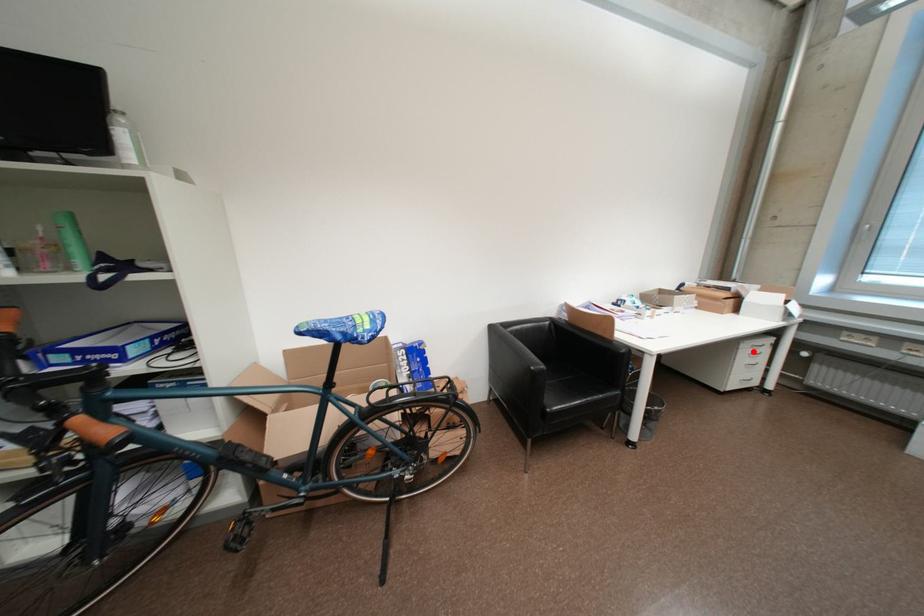
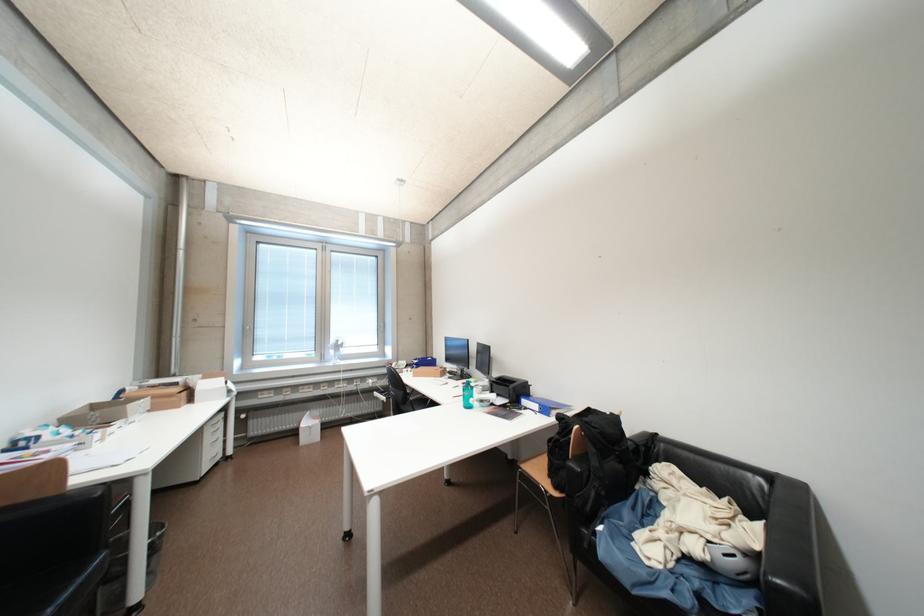
Question: I am providing you with two images of the same scene from different viewpoints. Image1 has a red point marked. In image2, the corresponding 3D location appears at what relative position? Reply with the corresponding letter.

Choices:
 (A) Closer
 (B) Farther

Answer: (A)